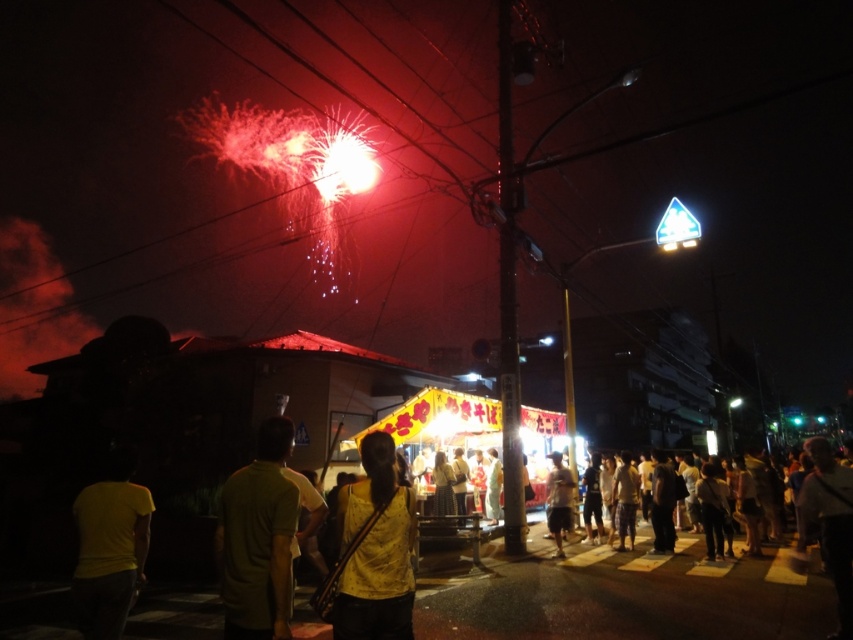
Question: Is the position of yellow matte shirt at center more distant than that of yellow matte shirt at lower left?

Choices:
 (A) yes
 (B) no

Answer: (B)

Question: Does yellow matte shirt at center appear over yellow matte shirt at lower left?

Choices:
 (A) no
 (B) yes

Answer: (B)

Question: Which of these objects is positioned farthest from the yellow matte shirt at center?

Choices:
 (A) yellow matte shirt at lower left
 (B) light brown fabric pants at center

Answer: (B)

Question: Is yellow matte shirt at center to the right of yellow matte shirt at lower left from the viewer's perspective?

Choices:
 (A) yes
 (B) no

Answer: (A)

Question: Which point is closer to the camera?

Choices:
 (A) yellow matte shirt at center
 (B) light brown fabric pants at center
 (C) yellow matte shirt at lower left

Answer: (A)

Question: Among these points, which one is nearest to the camera?

Choices:
 (A) (556, 456)
 (B) (349, 513)

Answer: (B)